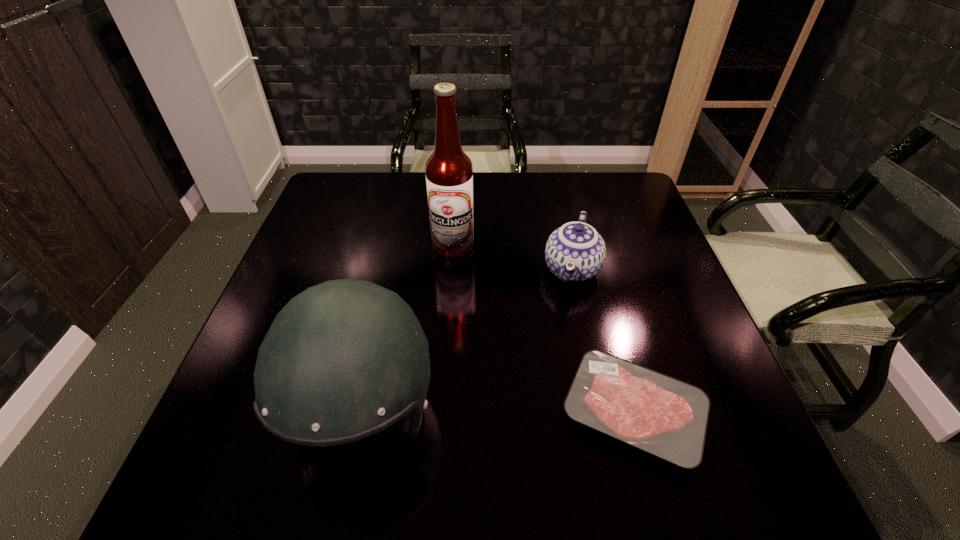
The image size is (960, 540). Find the location of `free space on the desktop that is between the football helmet and the shortest object and is positioned on the label side of the alcohol`. free space on the desktop that is between the football helmet and the shortest object and is positioned on the label side of the alcohol is located at coordinates (508, 413).

Locate an element on the screen. This screenshot has width=960, height=540. free space on the desktop that is between the football helmet and the shortest object and is positioned at the spout of the chinaware is located at coordinates (536, 413).